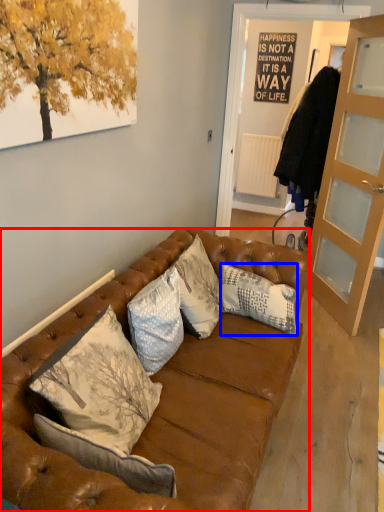
Question: Which object is closer to the camera taking this photo, studio couch (highlighted by a red box) or pillow (highlighted by a blue box)?

Choices:
 (A) studio couch
 (B) pillow

Answer: (A)